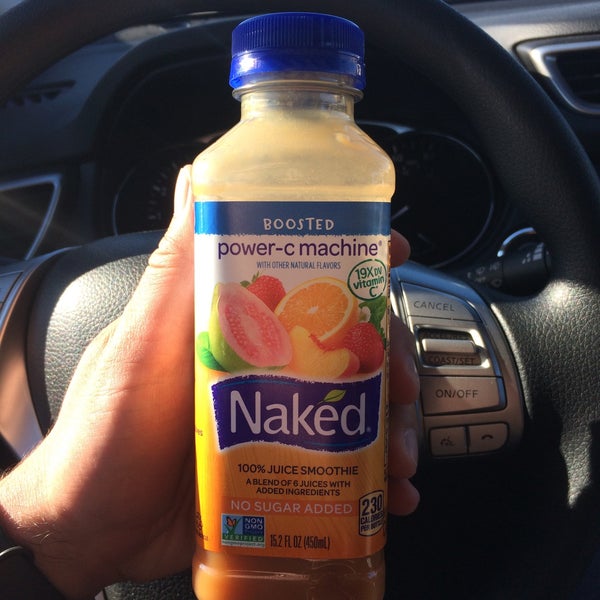
In order to click on 1 bottle cap in this screenshot , I will do `click(330, 53)`.